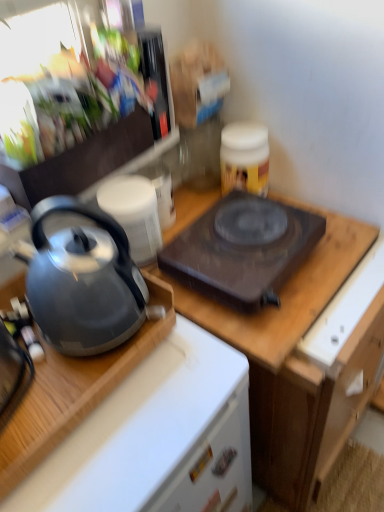
Question: Is shiny metallic kettle at left, which appears as the 1th appliance when ordered from the bottom, in front of or behind wooden cutting board at upper center in the image?

Choices:
 (A) front
 (B) behind

Answer: (B)

Question: Would you say shiny metallic kettle at left, which appears as the 1th appliance when ordered from the bottom, is to the left or to the right of wooden cutting board at upper center in the picture?

Choices:
 (A) right
 (B) left

Answer: (B)

Question: Based on their relative distances, which object is farther from the metallic silver kettle at upper left, placed as the 2th appliance when sorted from bottom to top?

Choices:
 (A) shiny metallic kettle at left, which appears as the 1th appliance when ordered from the bottom
 (B) wooden cutting board at center
 (C) matte gray kettle at left
 (D) wooden cutting board at upper center
 (E) black matte electric stove at center

Answer: (D)

Question: Which object is positioned farthest from the satin silver kettle at left?

Choices:
 (A) metallic silver kettle at upper left, the 1th appliance from the top
 (B) black matte electric stove at center
 (C) wooden cutting board at center
 (D) matte gray kettle at left
 (E) white matte drawer at lower center

Answer: (A)